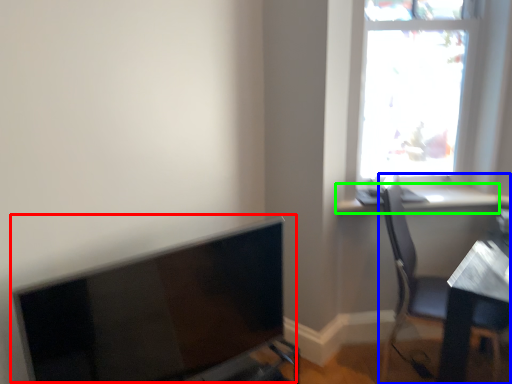
Question: Which object is positioned closest to computer monitor (highlighted by a red box)? Select from chair (highlighted by a blue box) and window sill (highlighted by a green box).

Choices:
 (A) chair
 (B) window sill

Answer: (A)